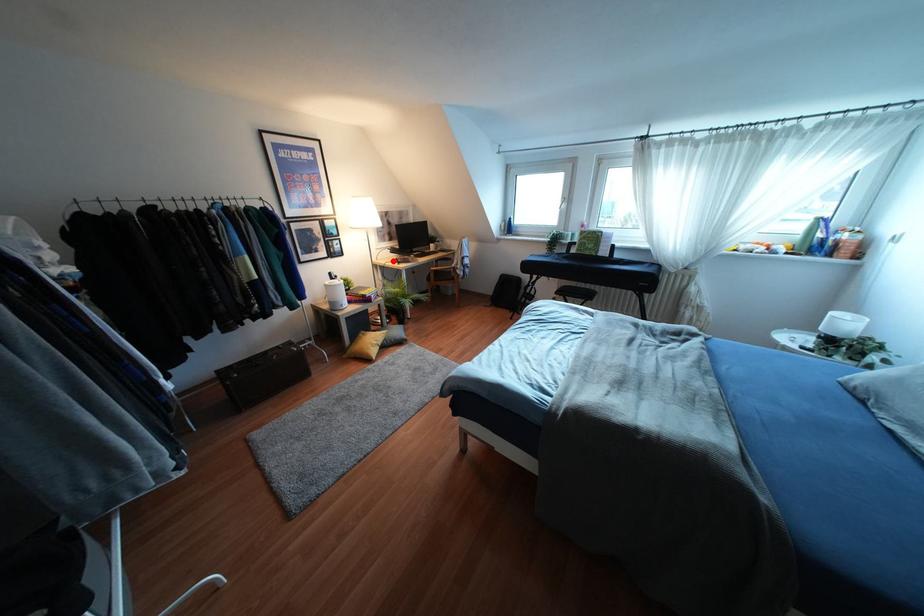
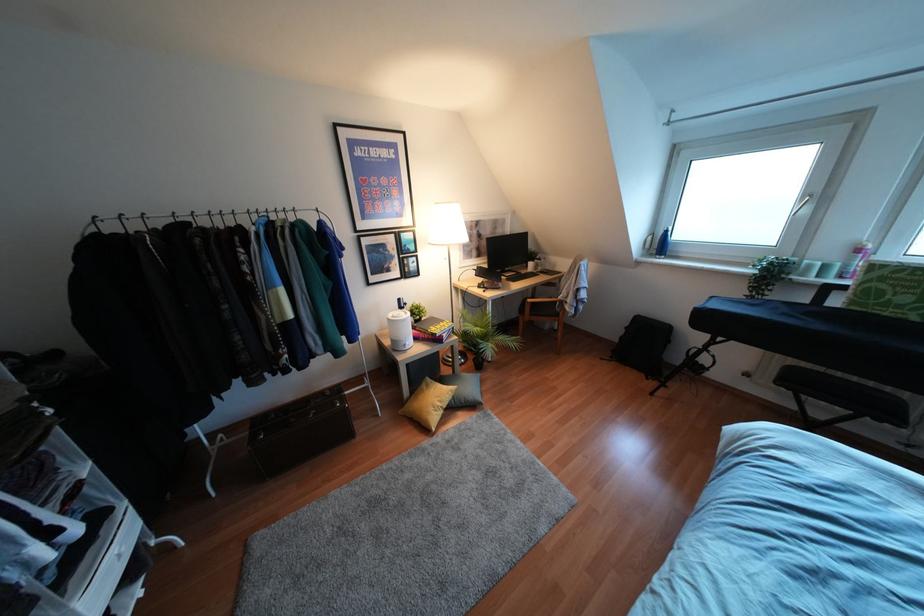
Question: A red point is marked in image1. In image2, is the corresponding 3D point closer to the camera or farther? Reply with the corresponding letter.

Choices:
 (A) The corresponding 3D point is closer.
 (B) The corresponding 3D point is farther.

Answer: (B)